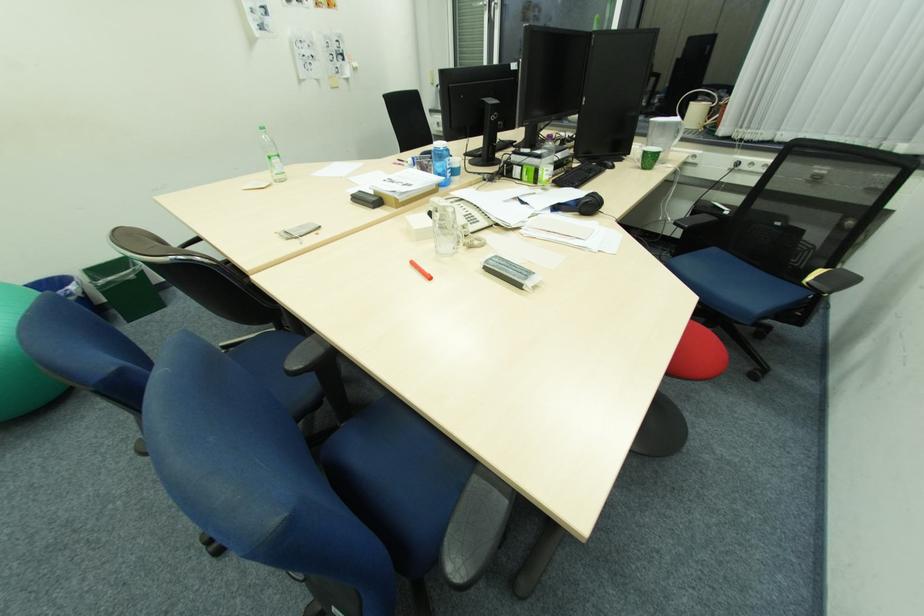
Find where to placing_in the green trash can. Please return your answer as a coordinate pair (x, y).

(125, 286)